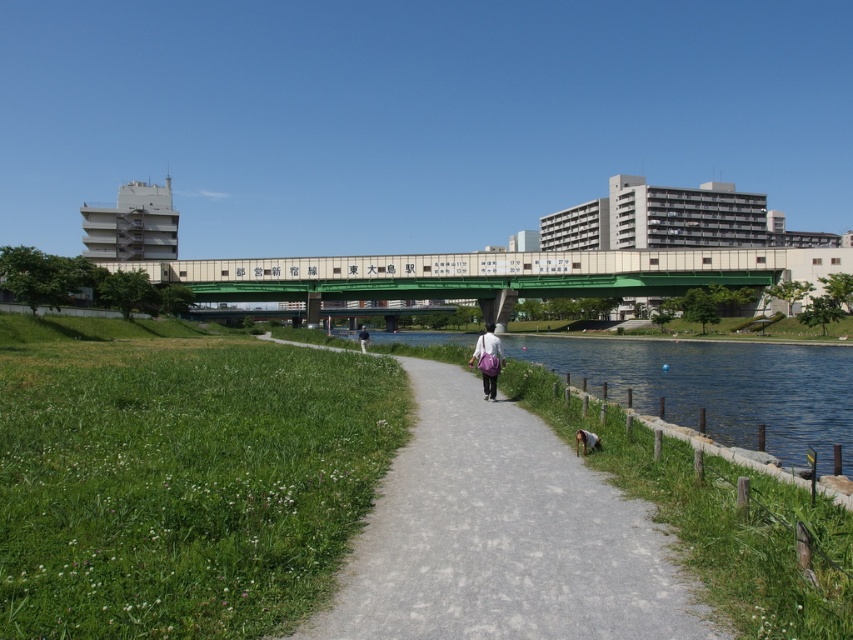
You are standing at the start of the path in the park and see the green grass at lower left and the light blue fabric shirt at center. Which object is closer to the camera?

The light blue fabric shirt at center is closer to the camera because the green grass at lower left is positioned on its right side, indicating it is further away.

You are standing at the edge of the green grass at lower left and want to walk towards the light blue fabric shirt at center. Is the path between them clear of any obstacles?

The green grass at lower left is closer to the viewer than the light blue fabric shirt at center, so there are no obstacles blocking the path between them.